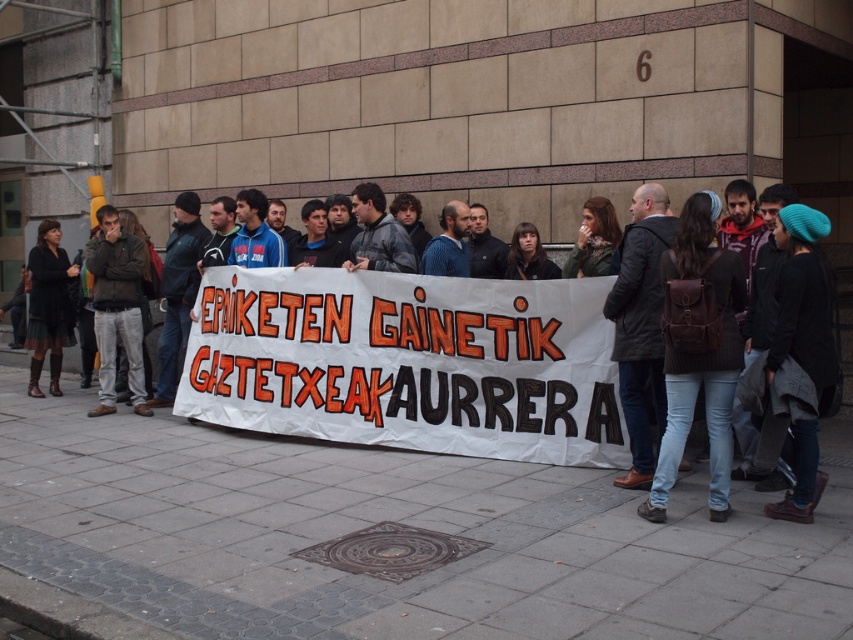
Which of these two, dark blue knit hat at center or dark brown leather jacket at left, stands taller?

dark brown leather jacket at left is taller.

Does dark blue knit hat at center lie in front of dark brown leather jacket at left?

Yes, dark blue knit hat at center is in front of dark brown leather jacket at left.

Image resolution: width=853 pixels, height=640 pixels. Describe the element at coordinates (405, 364) in the screenshot. I see `dark blue knit hat at center` at that location.

The width and height of the screenshot is (853, 640). Find the location of `dark blue knit hat at center`. dark blue knit hat at center is located at coordinates (405, 364).

Does dark blue knit hat at center appear on the right side of matte black dress at left?

Indeed, dark blue knit hat at center is positioned on the right side of matte black dress at left.

Which of these two, dark blue knit hat at center or matte black dress at left, stands taller?

matte black dress at left

Which is behind, point (401, 412) or point (71, 310)?

Positioned behind is point (71, 310).

Locate an element on the screen. dark blue knit hat at center is located at coordinates (405, 364).

Is dark brown leather jacket at left in front of matte black dress at left?

Yes, dark brown leather jacket at left is in front of matte black dress at left.

Can you confirm if dark brown leather jacket at left is wider than matte black dress at left?

No.

Who is more forward, (138, 284) or (62, 339)?

Point (138, 284) is more forward.

At what (x,y) coordinates should I click in order to perform the action: click on dark brown leather jacket at left. Please return your answer as a coordinate pair (x, y). Image resolution: width=853 pixels, height=640 pixels. Looking at the image, I should click on (117, 308).